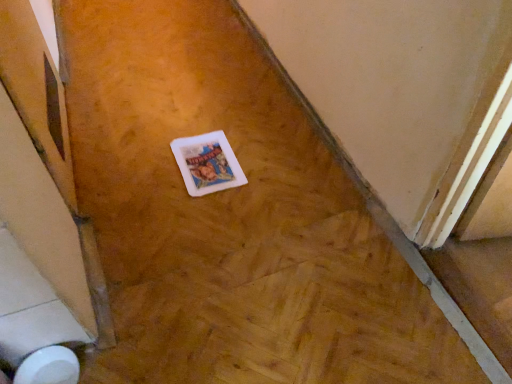
Identify the location of white glossy postcard at center. (207, 163).

This screenshot has width=512, height=384. What do you see at coordinates (207, 163) in the screenshot?
I see `white glossy postcard at center` at bounding box center [207, 163].

You are a GUI agent. You are given a task and a screenshot of the screen. Output one action in this format:
    pyautogui.click(x=<x>, y=<y>)
    Task: Click on the white glossy postcard at center
    This screenshot has width=512, height=384.
    Given the screenshot: What is the action you would take?
    click(x=207, y=163)